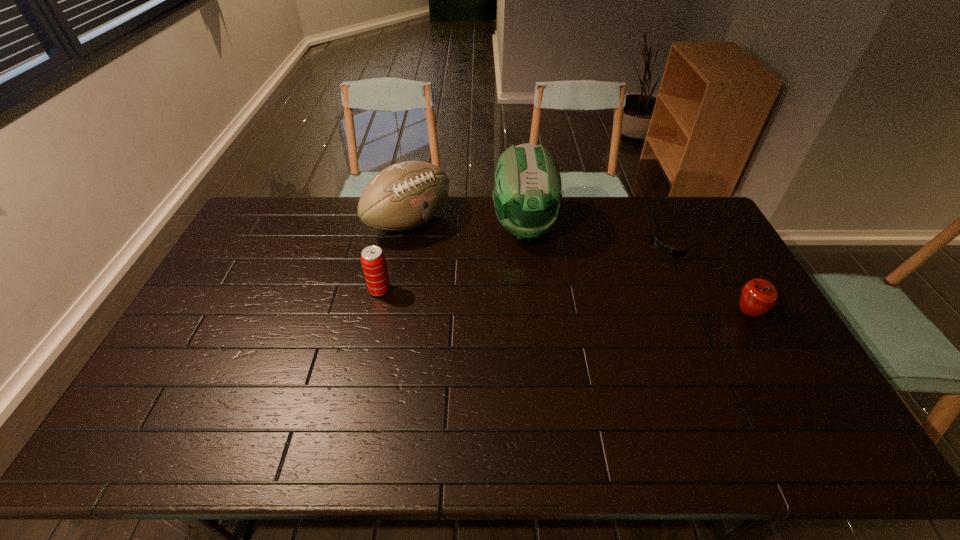
This screenshot has width=960, height=540. Identify the location of vacant space that's between the sunglasses and the tallest object. (600, 234).

Locate an element on the screen. This screenshot has width=960, height=540. free spot between the fourth tallest object and the second nearest object is located at coordinates (564, 301).

Where is `free space between the sunglasses and the fourth farthest object`? Image resolution: width=960 pixels, height=540 pixels. free space between the sunglasses and the fourth farthest object is located at coordinates (528, 266).

I want to click on unoccupied position between the second nearest object and the fourth shortest object, so click(x=395, y=256).

Identify the location of empty space between the fourth shortest object and the fourth tallest object. The width and height of the screenshot is (960, 540). (579, 267).

In order to click on free space between the shortest object and the soda can in this screenshot , I will do [x=528, y=266].

The width and height of the screenshot is (960, 540). Identify the location of free space between the shortest object and the second nearest object. (528, 266).

Locate an element on the screen. This screenshot has width=960, height=540. unoccupied area between the nearest object and the tallest object is located at coordinates (636, 269).

Find the location of `free spot between the fourth tallest object and the tallest object`. free spot between the fourth tallest object and the tallest object is located at coordinates (636, 269).

Identify which object is the fourth nearest to the fourth farthest object. Please provide its 2D coordinates. Your answer should be formatted as a tuple, i.e. [(x, y)], where the tuple contains the x and y coordinates of a point satisfying the conditions above.

[(758, 296)]